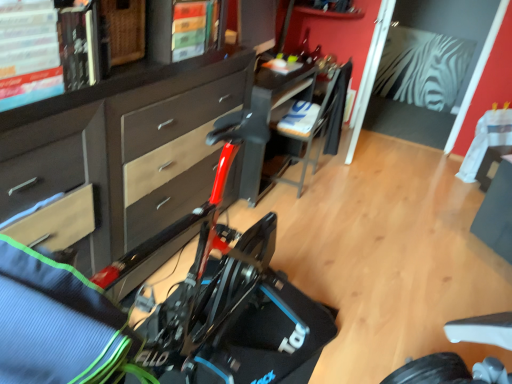
Question: Is matte brown cabinet at center wider or thinner than black plastic table at center?

Choices:
 (A) thin
 (B) wide

Answer: (A)

Question: Relative to black plastic table at center, is matte brown cabinet at center in front or behind?

Choices:
 (A) behind
 (B) front

Answer: (B)

Question: Considering the real-world distances, which object is farthest from the black plastic chair at center?

Choices:
 (A) matte brown cabinet at center
 (B) black plastic table at center

Answer: (A)

Question: Estimate the real-world distances between objects in this image. Which object is closer to the black plastic table at center?

Choices:
 (A) black plastic chair at center
 (B) matte brown cabinet at center

Answer: (A)